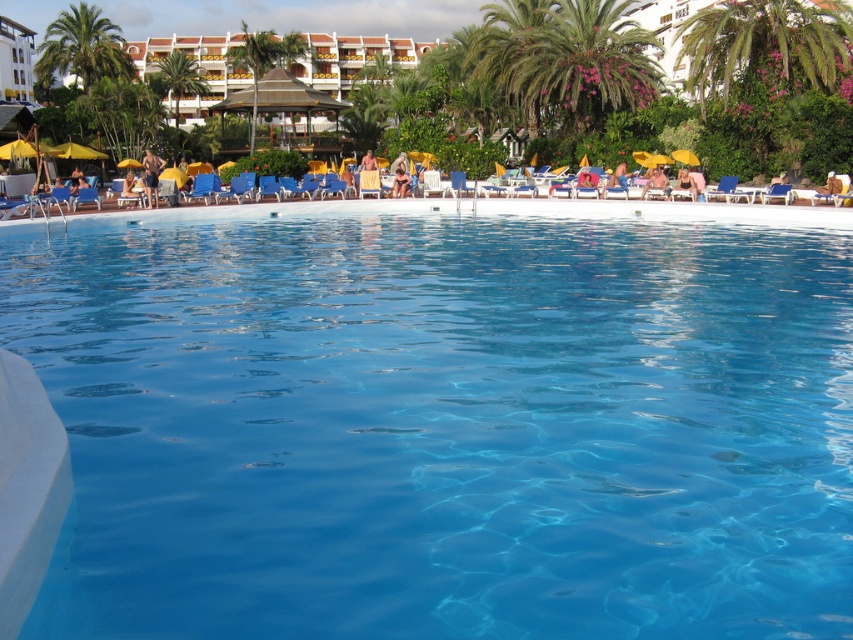
Question: Which object is the farthest from the green leafy palm tree at upper right?

Choices:
 (A) green leafy palm tree at upper center
 (B) beige fabric beach chair at center

Answer: (A)

Question: Does beige fabric chair at upper right have a lesser width compared to matte black bikini at center?

Choices:
 (A) yes
 (B) no

Answer: (B)

Question: Which point is closer to the camera?

Choices:
 (A) green leafy palm tree at upper right
 (B) transparent glass pool at center
 (C) beige fabric chair at upper right
 (D) yellow fabric umbrella at upper center

Answer: (B)

Question: Does green leafy palm tree at upper center appear under pink fabric towel at center?

Choices:
 (A) yes
 (B) no

Answer: (B)

Question: Is matte black bikini at center above tan skin person at center?

Choices:
 (A) yes
 (B) no

Answer: (B)

Question: Which object is closer to the camera taking this photo?

Choices:
 (A) green leafy palm tree at upper left
 (B) tan skin man at left
 (C) green leafy palm tree at upper center
 (D) tan skin person at center

Answer: (B)